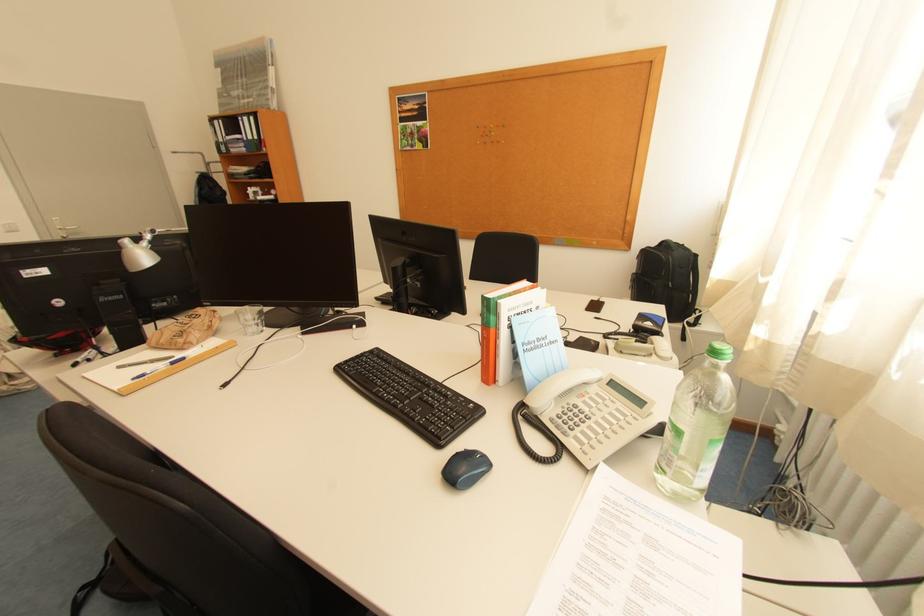
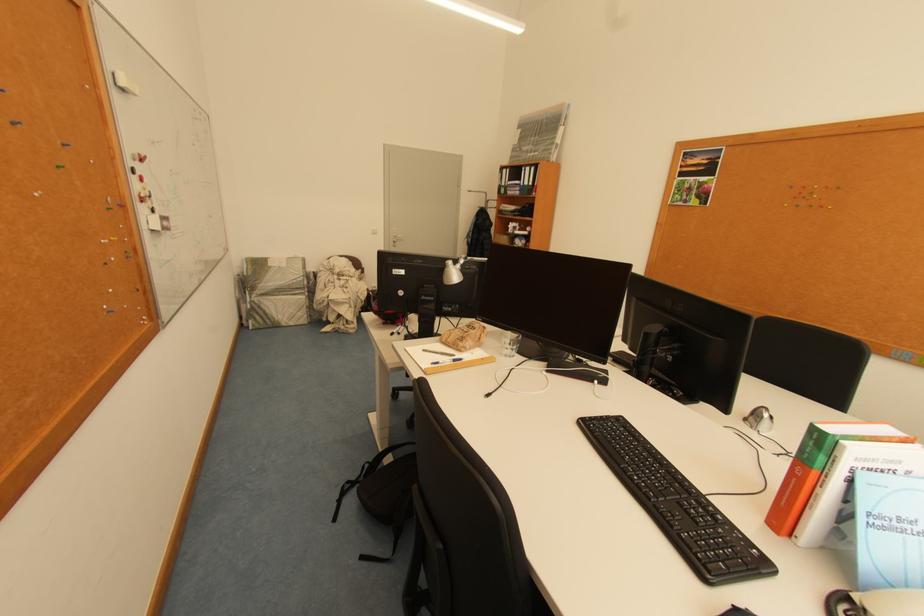
The point at (537, 349) is marked in the first image. Where is the corresponding point in the second image?

(886, 524)